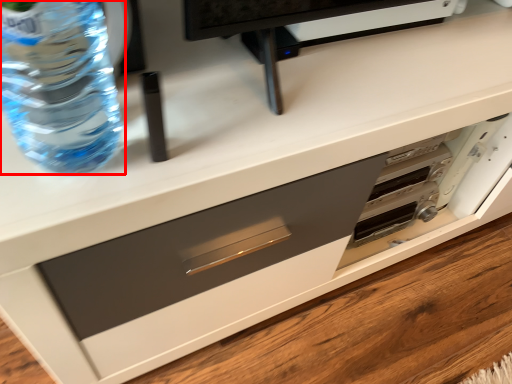
Question: Observing the image, what is the correct spatial positioning of bottle (annotated by the red box) in reference to drawer?

Choices:
 (A) left
 (B) right

Answer: (A)